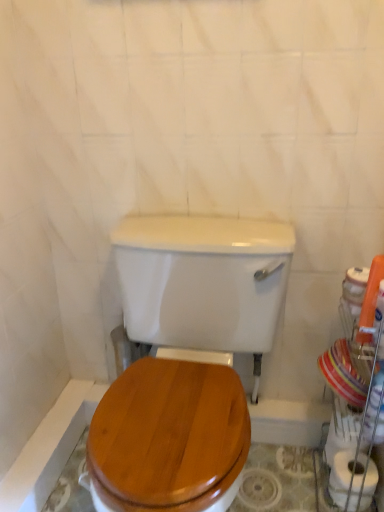
Question: Does white matte toilet paper at lower right have a larger size compared to white glossy porcelain at right?

Choices:
 (A) no
 (B) yes

Answer: (A)

Question: Does white matte toilet paper at lower right have a lesser height compared to white glossy porcelain at right?

Choices:
 (A) yes
 (B) no

Answer: (A)

Question: Does white matte toilet paper at lower right come in front of white glossy porcelain at right?

Choices:
 (A) no
 (B) yes

Answer: (A)

Question: Considering the relative sizes of white matte toilet paper at lower right and white glossy porcelain at right in the image provided, is white matte toilet paper at lower right thinner than white glossy porcelain at right?

Choices:
 (A) no
 (B) yes

Answer: (B)

Question: Are white matte toilet paper at lower right and white glossy porcelain at right far apart?

Choices:
 (A) no
 (B) yes

Answer: (A)

Question: Looking at the image, does white matte toilet paper at lower right seem bigger or smaller compared to white glossy porcelain at right?

Choices:
 (A) small
 (B) big

Answer: (A)

Question: In terms of width, does white matte toilet paper at lower right look wider or thinner when compared to white glossy porcelain at right?

Choices:
 (A) wide
 (B) thin

Answer: (B)

Question: Considering the positions of white matte toilet paper at lower right and white glossy porcelain at right in the image, is white matte toilet paper at lower right taller or shorter than white glossy porcelain at right?

Choices:
 (A) short
 (B) tall

Answer: (A)

Question: From the image's perspective, relative to white glossy porcelain at right, is white matte toilet paper at lower right above or below?

Choices:
 (A) above
 (B) below

Answer: (B)

Question: Is point (327, 355) closer or farther from the camera than point (344, 468)?

Choices:
 (A) farther
 (B) closer

Answer: (A)

Question: Would you say white glossy porcelain at right is to the left or to the right of white matte toilet paper at lower right in the picture?

Choices:
 (A) left
 (B) right

Answer: (A)

Question: From a real-world perspective, is white glossy porcelain at right positioned above or below white matte toilet paper at lower right?

Choices:
 (A) below
 (B) above

Answer: (B)

Question: Based on their sizes in the image, would you say white glossy porcelain at right is bigger or smaller than white matte toilet paper at lower right?

Choices:
 (A) big
 (B) small

Answer: (A)

Question: From the image's perspective, is wooden toilet seat at center located above or below white matte toilet paper at lower right?

Choices:
 (A) above
 (B) below

Answer: (A)

Question: In the image, is wooden toilet seat at center on the left side or the right side of white matte toilet paper at lower right?

Choices:
 (A) right
 (B) left

Answer: (B)